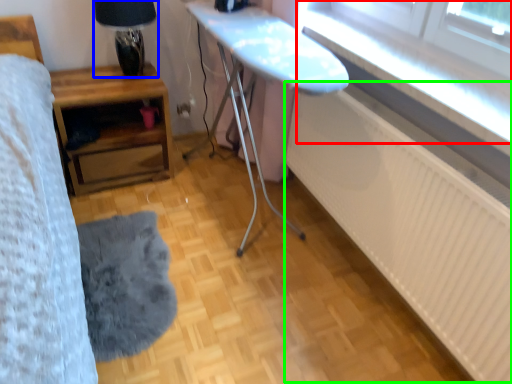
Question: Estimate the real-world distances between objects in this image. Which object is farther from window (highlighted by a red box), table lamp (highlighted by a blue box) or radiator (highlighted by a green box)?

Choices:
 (A) table lamp
 (B) radiator

Answer: (A)